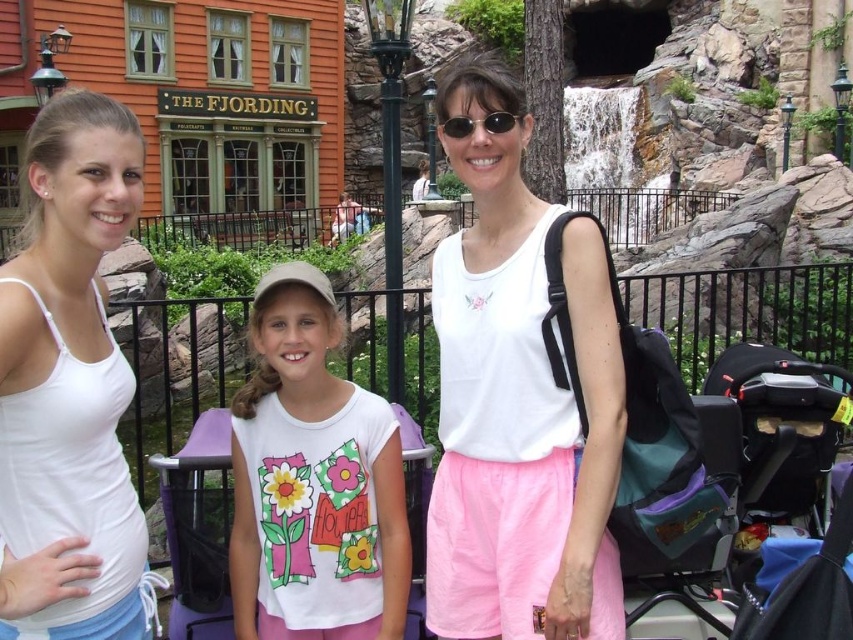
In the scene shown: You are a photographer standing in the themed park scene. You want to take a photo that includes both the point at coordinates point (341, 518) and point (514, 122). Since you want the closer object to be in focus, which point should you focus on?

Point (341, 518) is closer to the viewer than point (514, 122), so you should focus on point (341, 518) to ensure the closer object is in focus.